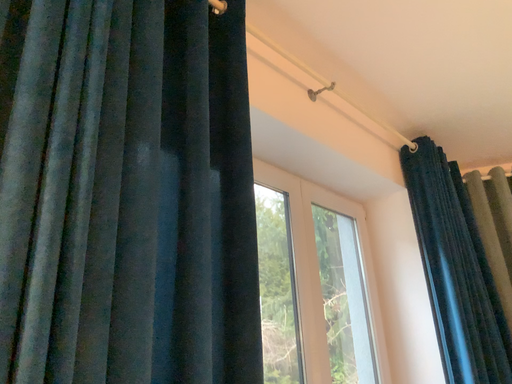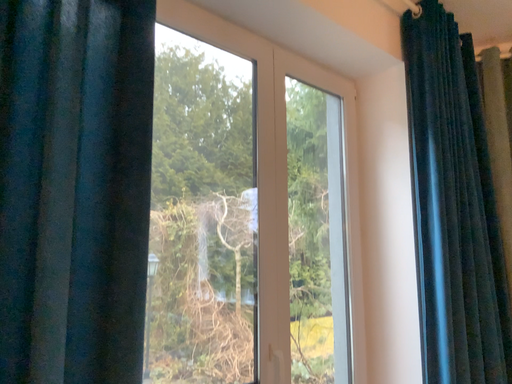
Question: Which way did the camera rotate in the video?

Choices:
 (A) rotated upward
 (B) rotated downward

Answer: (B)